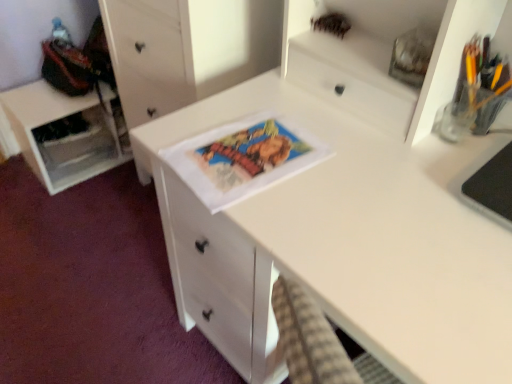
Find the location of a particular element. The width and height of the screenshot is (512, 384). free space in front of white matte cabinet at left is located at coordinates (78, 213).